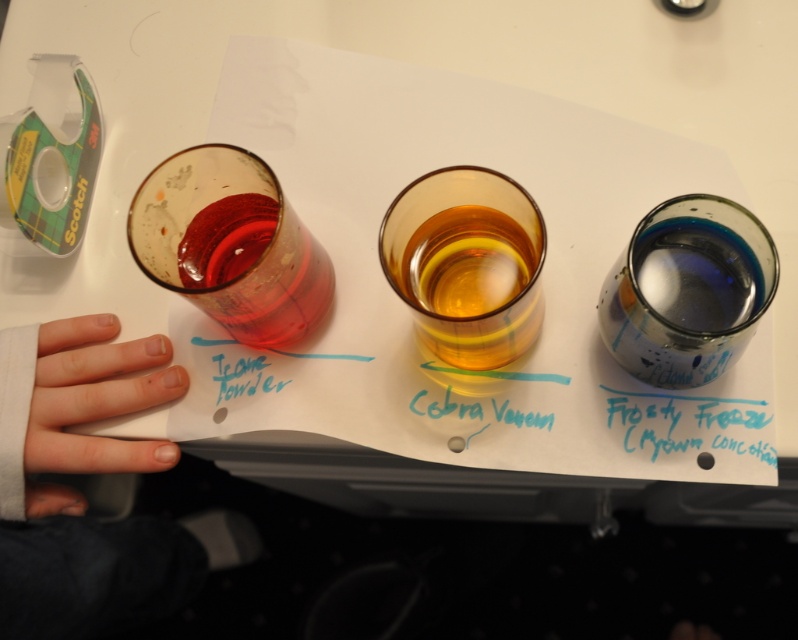
Is white fabric hand at lower left bigger than amber glass at center?

Yes, white fabric hand at lower left is bigger than amber glass at center.

Is point (123, 528) positioned behind point (520, 214)?

Yes.

At what (x,y) coordinates should I click in order to perform the action: click on white fabric hand at lower left. Please return your answer as a coordinate pair (x, y). Looking at the image, I should click on (78, 493).

Between white fabric hand at lower left and transparent glass at upper right, which one is positioned lower?

white fabric hand at lower left is below.

Is point (137, 595) farther from viewer compared to point (611, 332)?

Yes, point (137, 595) is behind point (611, 332).

Which is behind, point (117, 458) or point (619, 360)?

The point (117, 458) is more distant.

This screenshot has height=640, width=798. Find the location of `white fabric hand at lower left`. white fabric hand at lower left is located at coordinates (78, 493).

Which is more to the right, amber glass at center or teal matte powder at upper left?

amber glass at center

The height and width of the screenshot is (640, 798). Describe the element at coordinates (465, 264) in the screenshot. I see `amber glass at center` at that location.

At what (x,y) coordinates should I click in order to perform the action: click on amber glass at center. Please return your answer as a coordinate pair (x, y). Looking at the image, I should click on (465, 264).